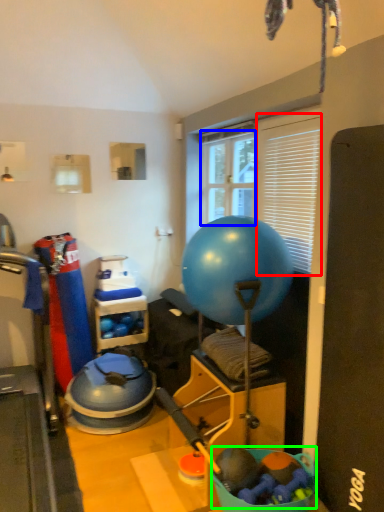
Question: Considering the real-world distances, which object is closest to window screen (highlighted by a red box)? window screen (highlighted by a blue box) or toy (highlighted by a green box).

Choices:
 (A) window screen
 (B) toy

Answer: (A)